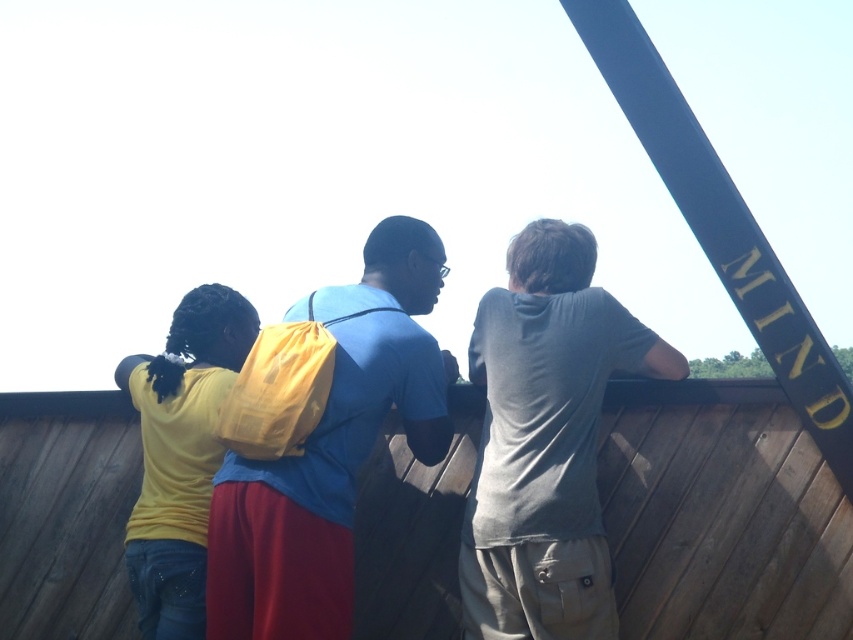
Question: Where is blue matte shirt at center located in relation to yellow matte backpack at left in the image?

Choices:
 (A) below
 (B) above

Answer: (B)

Question: Which of the following is the farthest from the observer?

Choices:
 (A) blue polished wood beam at upper right
 (B) yellow matte backpack at left
 (C) blue matte shirt at center

Answer: (B)

Question: Which object is closer to the camera taking this photo?

Choices:
 (A) blue matte shirt at center
 (B) yellow matte backpack at left
 (C) blue polished wood beam at upper right

Answer: (A)

Question: Which of the following is the closest to the observer?

Choices:
 (A) yellow matte backpack at left
 (B) gray cotton shirt at upper right

Answer: (B)

Question: Can you confirm if blue matte shirt at center is smaller than yellow matte backpack at left?

Choices:
 (A) no
 (B) yes

Answer: (B)

Question: Does blue polished wood beam at upper right lie in front of yellow matte backpack at left?

Choices:
 (A) no
 (B) yes

Answer: (B)